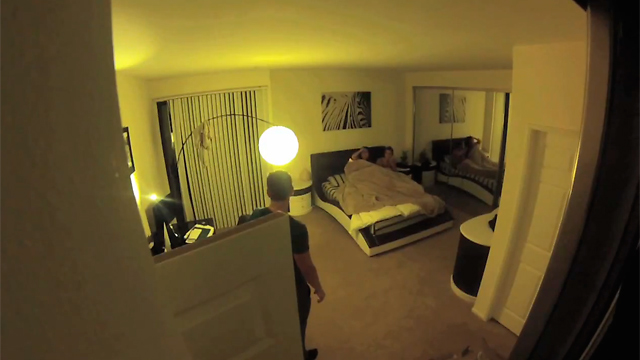
The width and height of the screenshot is (640, 360). I want to click on bed, so point(380,195).